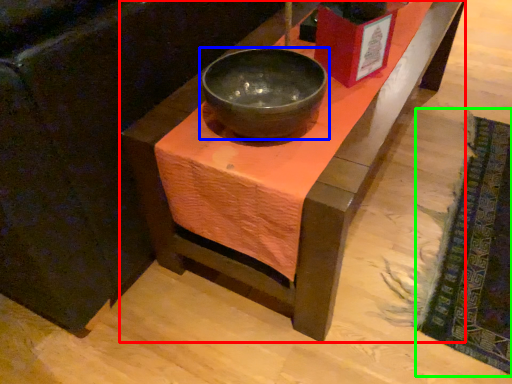
Question: Estimate the real-world distances between objects in this image. Which object is closer to table (highlighted by a red box), bowl (highlighted by a blue box) or mat (highlighted by a green box)?

Choices:
 (A) bowl
 (B) mat

Answer: (A)